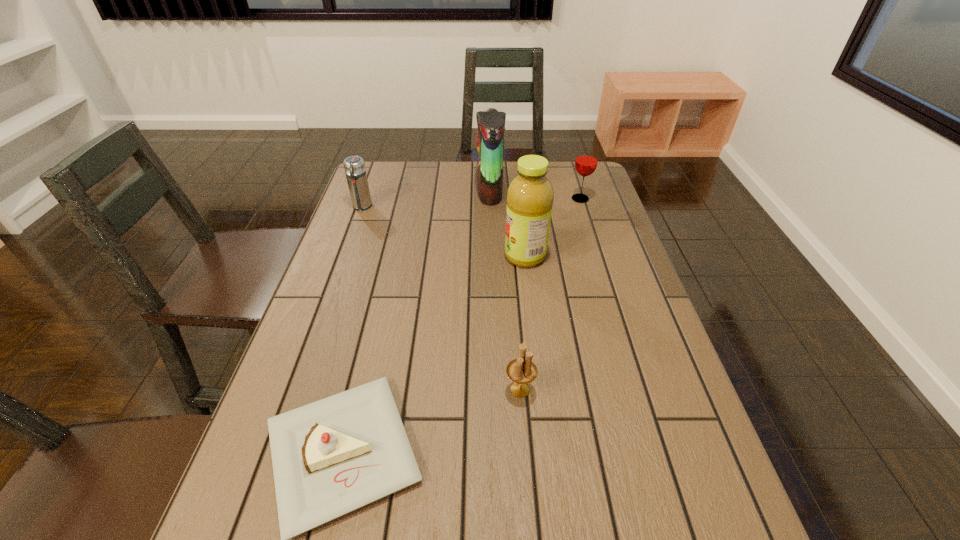
This screenshot has width=960, height=540. Find the location of `fruit juice`. fruit juice is located at coordinates (530, 196).

Image resolution: width=960 pixels, height=540 pixels. Identify the location of parrot. (491, 124).

Where is `glass`? The image size is (960, 540). glass is located at coordinates (586, 161).

Where is `thermos bottle`? This screenshot has height=540, width=960. thermos bottle is located at coordinates (354, 166).

The image size is (960, 540). What are the coordinates of `candle holder` in the screenshot? It's located at (522, 370).

Image resolution: width=960 pixels, height=540 pixels. Find the location of `vacant space located 0.230m on the front label of the fruit juice`. vacant space located 0.230m on the front label of the fruit juice is located at coordinates pyautogui.click(x=422, y=256).

I want to click on blank space located on the front label of the fruit juice, so click(x=397, y=256).

At what (x,y) coordinates should I click in order to perform the action: click on vacant space situated 0.100m on the front label of the fruit juice. Please return your answer as a coordinate pair (x, y). The image size is (960, 540). Looking at the image, I should click on (468, 256).

Image resolution: width=960 pixels, height=540 pixels. What are the coordinates of `vacant space located 0.370m at the face of the parrot` in the screenshot? It's located at pos(368,191).

You are a GUI agent. You are given a task and a screenshot of the screen. Output one action in this format:
    pyautogui.click(x=<x>, y=<y>)
    Task: Click on the free space located 0.300m at the face of the parrot
    This screenshot has width=960, height=540.
    Given the screenshot: What is the action you would take?
    tap(388, 191)